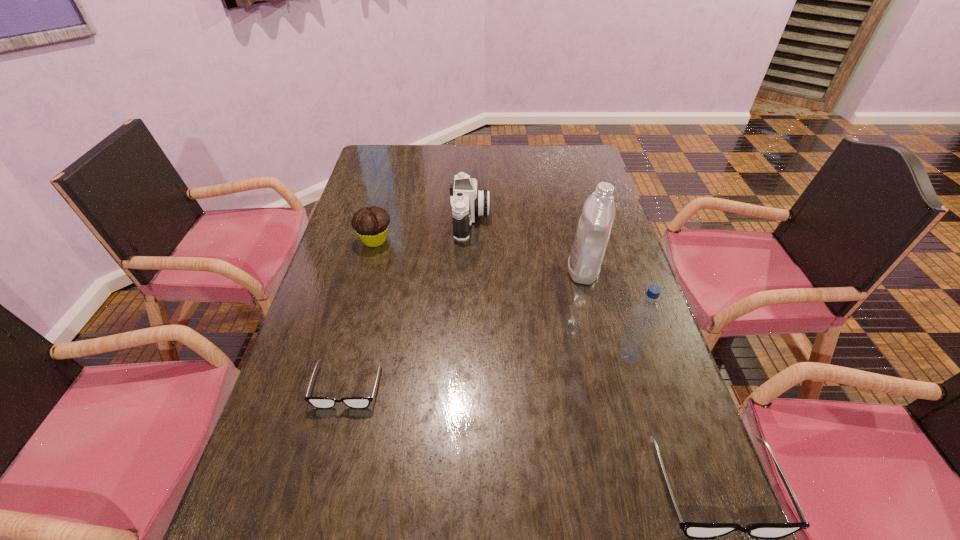
Locate an element on the screen. This screenshot has width=960, height=540. vacant point at the far right corner is located at coordinates (590, 158).

The image size is (960, 540). In order to click on free space at the near right corner in this screenshot , I will do `click(699, 518)`.

The image size is (960, 540). I want to click on free area in between the fifth shortest object and the muffin, so click(x=502, y=298).

Identify the location of empty space that is in between the fifth shortest object and the muffin. This screenshot has height=540, width=960. (502, 298).

Find the location of a particular element. This screenshot has height=540, width=960. free space that is in between the camera and the third shortest object is located at coordinates (422, 230).

Locate an element on the screen. The height and width of the screenshot is (540, 960). free space between the third shortest object and the third tallest object is located at coordinates (422, 230).

This screenshot has width=960, height=540. In order to click on vacant area between the third shortest object and the fourth nearest object in this screenshot , I will do coord(479,255).

The width and height of the screenshot is (960, 540). Find the location of `vacant space that's between the shortest object and the camera`. vacant space that's between the shortest object and the camera is located at coordinates (409, 303).

Where is `object that is the third closest one to the detergent`? This screenshot has height=540, width=960. object that is the third closest one to the detergent is located at coordinates (694, 530).

Identify which object is the closest to the fifth shortest object. Please provide its 2D coordinates. Your answer should be formatted as a tuple, i.e. [(x, y)], where the tuple contains the x and y coordinates of a point satisfying the conditions above.

[(694, 530)]